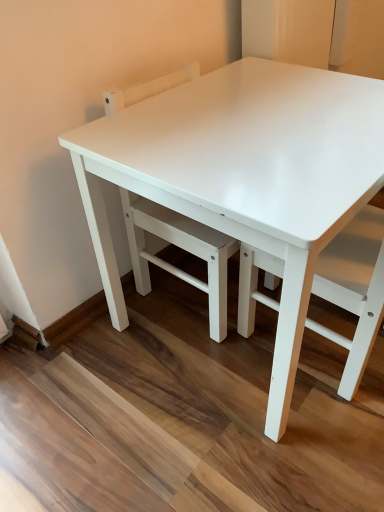
Question: Does white glossy table at center turn towards white matte chair at center?

Choices:
 (A) no
 (B) yes

Answer: (B)

Question: Can you confirm if white glossy table at center is shorter than white matte chair at center?

Choices:
 (A) yes
 (B) no

Answer: (B)

Question: Is white glossy table at center closer to camera compared to white matte chair at center?

Choices:
 (A) yes
 (B) no

Answer: (A)

Question: Is white glossy table at center wider than white matte chair at center?

Choices:
 (A) no
 (B) yes

Answer: (B)

Question: Could white matte chair at center be considered to be inside white glossy table at center?

Choices:
 (A) yes
 (B) no

Answer: (A)

Question: Does white glossy table at center have a lesser width compared to white matte chair at center?

Choices:
 (A) yes
 (B) no

Answer: (B)

Question: Considering the relative sizes of white matte chair at center and white glossy table at center in the image provided, is white matte chair at center taller than white glossy table at center?

Choices:
 (A) no
 (B) yes

Answer: (A)

Question: Would you consider white matte chair at center to be distant from white glossy table at center?

Choices:
 (A) no
 (B) yes

Answer: (A)

Question: Does white matte chair at center appear on the left side of white glossy table at center?

Choices:
 (A) yes
 (B) no

Answer: (B)

Question: Considering the relative sizes of white matte chair at center and white glossy table at center in the image provided, is white matte chair at center shorter than white glossy table at center?

Choices:
 (A) yes
 (B) no

Answer: (A)

Question: From a real-world perspective, is white matte chair at center on top of white glossy table at center?

Choices:
 (A) no
 (B) yes

Answer: (B)

Question: Does white matte chair at center have a lesser width compared to white glossy table at center?

Choices:
 (A) no
 (B) yes

Answer: (B)

Question: From a real-world perspective, is white matte chair at center over white glossy table top at center?

Choices:
 (A) yes
 (B) no

Answer: (B)